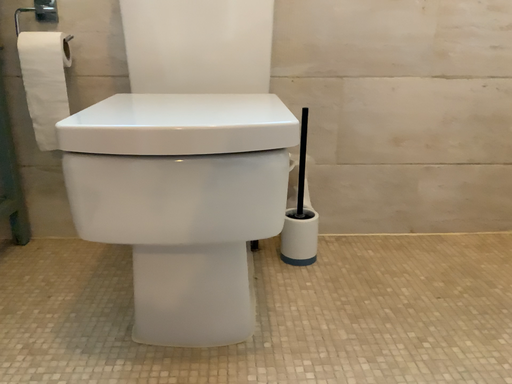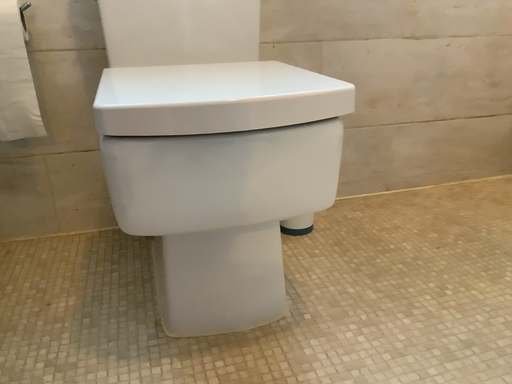
Question: Which way did the camera rotate in the video?

Choices:
 (A) rotated right
 (B) rotated left

Answer: (A)